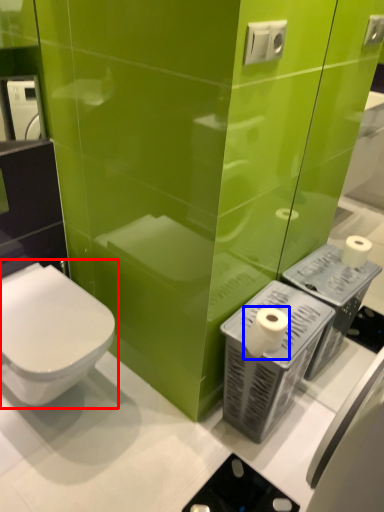
Question: Which object appears farthest to the camera in this image, toilet (highlighted by a red box) or toilet paper (highlighted by a blue box)?

Choices:
 (A) toilet
 (B) toilet paper

Answer: (B)